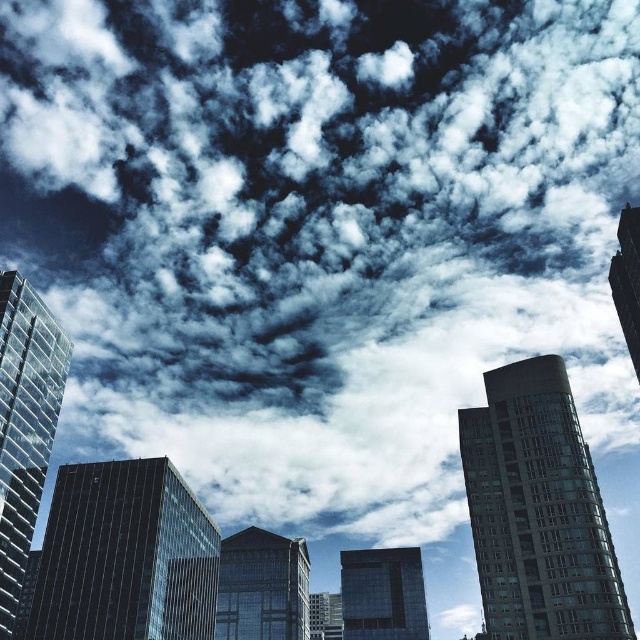
In the scene shown: You are an architect reviewing a cityscape design. You notice two structures in the center of the image, the glassy reflective skyscraper at center and the glassy black building at center. Which one appears closer to you based on their positions?

The glassy reflective skyscraper at center is positioned over the glassy black building at center, so it appears closer to you.

You are an architect analyzing the urban skyline. You notice the glassy reflective skyscraper at center and the smooth glass skyscraper at upper right. Which of these two buildings is positioned higher in the image?

The smooth glass skyscraper at upper right is positioned higher in the image than the glassy reflective skyscraper at center.